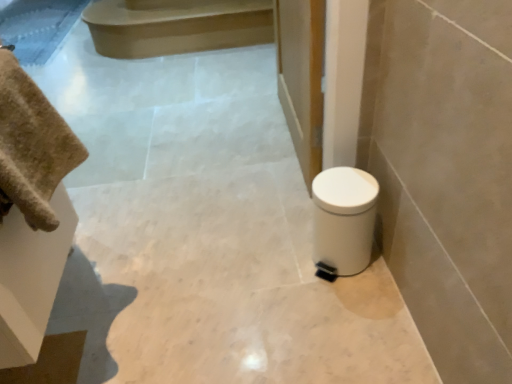
Question: Does beige cotton towel at left have a smaller size compared to white plastic toilet at lower right?

Choices:
 (A) no
 (B) yes

Answer: (B)

Question: From a real-world perspective, is beige cotton towel at left under white plastic toilet at lower right?

Choices:
 (A) no
 (B) yes

Answer: (A)

Question: From a real-world perspective, does beige cotton towel at left stand above white plastic toilet at lower right?

Choices:
 (A) yes
 (B) no

Answer: (A)

Question: Is the surface of beige cotton towel at left in direct contact with white plastic toilet at lower right?

Choices:
 (A) yes
 (B) no

Answer: (B)

Question: Is beige cotton towel at left far from white plastic toilet at lower right?

Choices:
 (A) no
 (B) yes

Answer: (A)

Question: From a real-world perspective, is beige cotton towel at left positioned above or below white plastic toilet at lower right?

Choices:
 (A) above
 (B) below

Answer: (A)

Question: Based on their sizes in the image, would you say beige cotton towel at left is bigger or smaller than white plastic toilet at lower right?

Choices:
 (A) big
 (B) small

Answer: (B)

Question: In the image, is beige cotton towel at left positioned in front of or behind white plastic toilet at lower right?

Choices:
 (A) behind
 (B) front

Answer: (B)

Question: Is beige cotton towel at left taller or shorter than white plastic toilet at lower right?

Choices:
 (A) tall
 (B) short

Answer: (B)

Question: Is white plastic toilet at lower right taller or shorter than smooth beige stair at upper center?

Choices:
 (A) tall
 (B) short

Answer: (A)

Question: Based on their sizes in the image, would you say white plastic toilet at lower right is bigger or smaller than smooth beige stair at upper center?

Choices:
 (A) big
 (B) small

Answer: (B)

Question: Choose the correct answer: Is white plastic toilet at lower right inside smooth beige stair at upper center or outside it?

Choices:
 (A) outside
 (B) inside

Answer: (A)

Question: Is white plastic toilet at lower right in front of or behind smooth beige stair at upper center in the image?

Choices:
 (A) behind
 (B) front

Answer: (B)

Question: Considering the positions of beige cotton towel at left and smooth beige stair at upper center in the image, is beige cotton towel at left taller or shorter than smooth beige stair at upper center?

Choices:
 (A) short
 (B) tall

Answer: (B)

Question: Is beige cotton towel at left situated inside smooth beige stair at upper center or outside?

Choices:
 (A) outside
 (B) inside

Answer: (A)